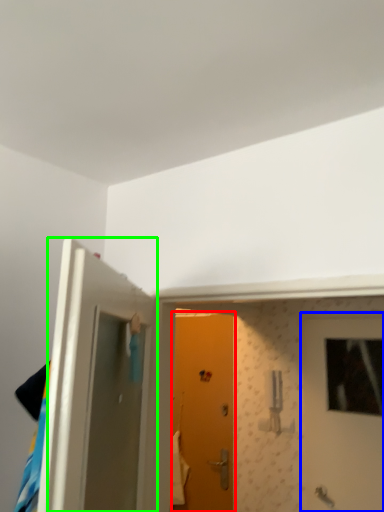
Question: Estimate the real-world distances between objects in this image. Which object is closer to door (highlighted by a red box), door (highlighted by a blue box) or door (highlighted by a green box)?

Choices:
 (A) door
 (B) door

Answer: (A)